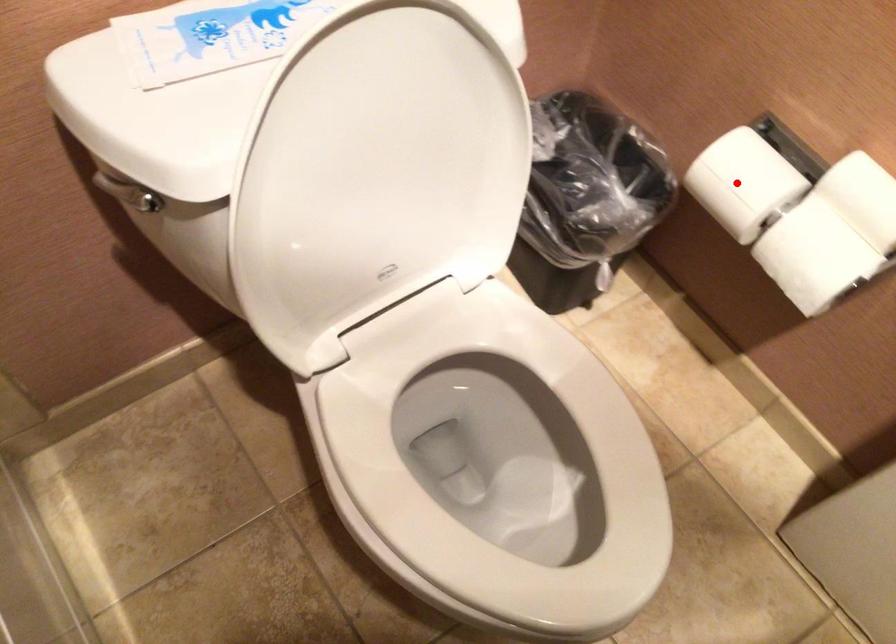
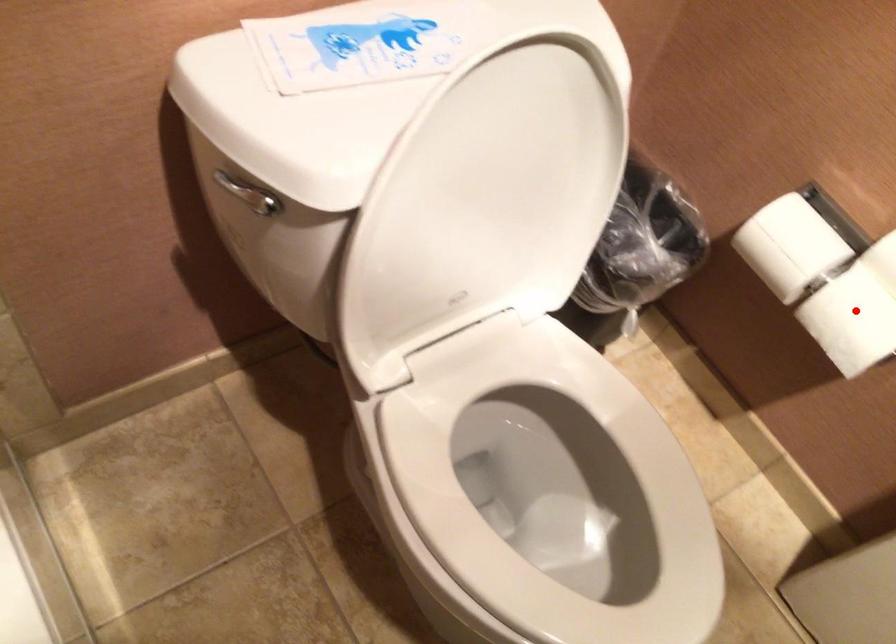
I am providing you with two images of the same scene from different viewpoints. A red point is marked on the first image and another point is marked on the second image. Is the marked point in image1 the same physical position as the marked point in image2?

No